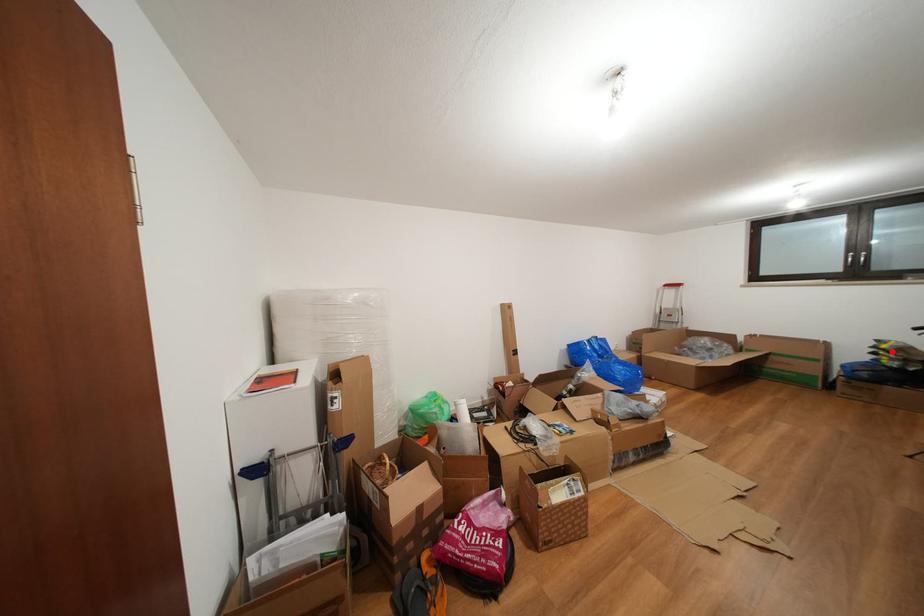
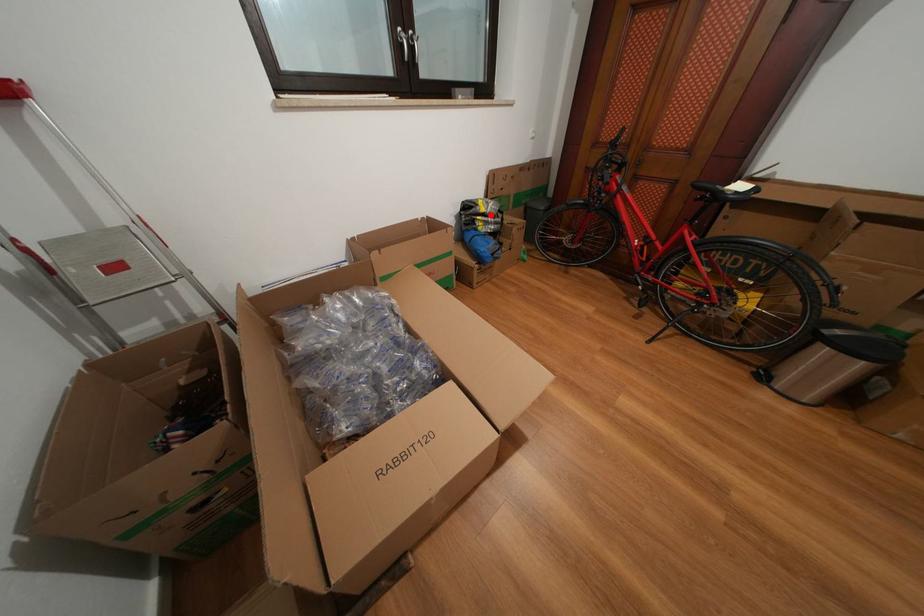
I am providing you with two images of the same scene from different viewpoints. A red point is marked on the first image and another point is marked on the second image. Do the highlighted points in image1 and image2 indicate the same real-world spot?

Yes